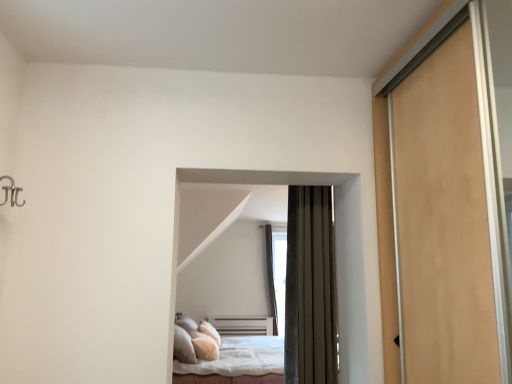
The image size is (512, 384). In order to click on transparent glass window at center in this screenshot , I will do `click(277, 275)`.

Describe the element at coordinates (225, 355) in the screenshot. The height and width of the screenshot is (384, 512). I see `white soft bed at center, positioned as the 1th bed in back-to-front order` at that location.

The height and width of the screenshot is (384, 512). Describe the element at coordinates (262, 177) in the screenshot. I see `dark brown fabric bed at center, which is the 2th bed from bottom to top` at that location.

This screenshot has height=384, width=512. I want to click on transparent glass window at center, so click(x=277, y=275).

Is transparent glass window at center facing towards dark brown fabric bed at center, which is the 2th bed from bottom to top?

No.

From a real-world perspective, between transparent glass window at center and dark brown fabric bed at center, the 1th bed viewed from the top, who is vertically lower?

transparent glass window at center.

Which object is further away from the camera taking this photo, transparent glass window at center or dark brown fabric bed at center, which ranks as the first bed in front-to-back order?

transparent glass window at center is behind.

Considering the sizes of objects transparent glass window at center and dark brown fabric bed at center, which ranks as the first bed in front-to-back order, in the image provided, who is wider, transparent glass window at center or dark brown fabric bed at center, which ranks as the first bed in front-to-back order,?

Wider between the two is transparent glass window at center.

Is dark brown fabric bed at center, which ranks as the 2th bed in back-to-front order, positioned far away from transparent glass window at center?

That's right, there is a large distance between dark brown fabric bed at center, which ranks as the 2th bed in back-to-front order, and transparent glass window at center.

Does point (169, 369) come in front of point (268, 268)?

Yes, it is.

Is dark brown fabric bed at center, which is the 2th bed from bottom to top, turned away from transparent glass window at center?

No, dark brown fabric bed at center, which is the 2th bed from bottom to top,'s orientation is not away from transparent glass window at center.

Is transparent glass window at center completely or partially inside dark brown fabric bed at center, which ranks as the 2th bed in back-to-front order?

That's incorrect, transparent glass window at center is not inside dark brown fabric bed at center, which ranks as the 2th bed in back-to-front order.

Is dark brown fabric bed at center, which ranks as the first bed in front-to-back order, not inside white soft bed at center, which appears as the second bed when viewed from the top?

Yes, dark brown fabric bed at center, which ranks as the first bed in front-to-back order, is outside of white soft bed at center, which appears as the second bed when viewed from the top.

Considering the positions of points (283, 173) and (211, 327), is point (283, 173) farther from camera compared to point (211, 327)?

No, it is not.

Who is smaller, dark brown fabric bed at center, which is the 2th bed from bottom to top, or white soft bed at center, positioned as the 1th bed in back-to-front order?

With smaller size is dark brown fabric bed at center, which is the 2th bed from bottom to top.

Is dark brown fabric bed at center, which ranks as the 2th bed in back-to-front order, to the left of white soft bed at center, positioned as the 1th bed in back-to-front order, from the viewer's perspective?

Incorrect, dark brown fabric bed at center, which ranks as the 2th bed in back-to-front order, is not on the left side of white soft bed at center, positioned as the 1th bed in back-to-front order.

Which object is more forward, white soft bed at center, positioned as the 1th bed in back-to-front order, or transparent glass window at center?

white soft bed at center, positioned as the 1th bed in back-to-front order.

From the image's perspective, which is below, white soft bed at center, marked as the first bed in a bottom-to-top arrangement, or transparent glass window at center?

white soft bed at center, marked as the first bed in a bottom-to-top arrangement, appears lower in the image.

Who is shorter, white soft bed at center, positioned as the 1th bed in back-to-front order, or transparent glass window at center?

With less height is white soft bed at center, positioned as the 1th bed in back-to-front order.

Between white soft bed at center, which appears as the second bed when viewed from the top, and dark brown fabric bed at center, which ranks as the first bed in front-to-back order, which one appears on the left side from the viewer's perspective?

white soft bed at center, which appears as the second bed when viewed from the top.

I want to click on bed to the left of dark brown fabric bed at center, which is the 2th bed from bottom to top, so click(225, 355).

Is point (240, 382) positioned behind point (188, 179)?

Yes, it is behind point (188, 179).

From a real-world perspective, is white soft bed at center, which appears as the second bed when viewed from the top, under dark brown fabric bed at center, the 1th bed viewed from the top?

Yes, from a real-world perspective, white soft bed at center, which appears as the second bed when viewed from the top, is beneath dark brown fabric bed at center, the 1th bed viewed from the top.

How distant is transparent glass window at center from white soft bed at center, positioned as the 1th bed in back-to-front order?

transparent glass window at center and white soft bed at center, positioned as the 1th bed in back-to-front order, are 1.01 meters apart from each other.

From a real-world perspective, is transparent glass window at center physically above white soft bed at center, positioned as the 1th bed in back-to-front order?

Yes, from a real-world perspective, transparent glass window at center is above white soft bed at center, positioned as the 1th bed in back-to-front order.

Is transparent glass window at center turned away from white soft bed at center, marked as the first bed in a bottom-to-top arrangement?

No, transparent glass window at center's orientation is not away from white soft bed at center, marked as the first bed in a bottom-to-top arrangement.

Is transparent glass window at center located outside white soft bed at center, marked as the first bed in a bottom-to-top arrangement?

Yes, transparent glass window at center is outside of white soft bed at center, marked as the first bed in a bottom-to-top arrangement.

The width and height of the screenshot is (512, 384). What are the coordinates of `window on the right of dark brown fabric bed at center, which ranks as the first bed in front-to-back order` in the screenshot? It's located at (277, 275).

Find the location of a particular element. window below the dark brown fabric bed at center, which ranks as the first bed in front-to-back order (from a real-world perspective) is located at coordinates (277, 275).

Considering their positions, is dark brown fabric bed at center, which is the 2th bed from bottom to top, positioned closer to transparent glass window at center than white soft bed at center, positioned as the 1th bed in back-to-front order?

Among the two, white soft bed at center, positioned as the 1th bed in back-to-front order, is located nearer to transparent glass window at center.

Estimate the real-world distances between objects in this image. Which object is closer to white soft bed at center, positioned as the 1th bed in back-to-front order, transparent glass window at center or dark brown fabric bed at center, which is the 2th bed from bottom to top?

Among the two, transparent glass window at center is located nearer to white soft bed at center, positioned as the 1th bed in back-to-front order.

Based on their spatial positions, is white soft bed at center, which is the second bed in front-to-back order, or dark brown fabric bed at center, which ranks as the first bed in front-to-back order, further from transparent glass window at center?

dark brown fabric bed at center, which ranks as the first bed in front-to-back order, lies further to transparent glass window at center than the other object.

Considering their positions, is white soft bed at center, which is the second bed in front-to-back order, positioned further to dark brown fabric bed at center, which is the 2th bed from bottom to top, than transparent glass window at center?

transparent glass window at center is positioned further to the anchor dark brown fabric bed at center, which is the 2th bed from bottom to top.

Considering their positions, is dark brown fabric bed at center, which is the 2th bed from bottom to top, positioned closer to white soft bed at center, which is the second bed in front-to-back order, than transparent glass window at center?

Among the two, transparent glass window at center is located nearer to white soft bed at center, which is the second bed in front-to-back order.

Looking at this image, which object lies further to the anchor point dark brown fabric bed at center, the 1th bed viewed from the top, transparent glass window at center or white soft bed at center, which is the second bed in front-to-back order?

transparent glass window at center.

At what (x,y) coordinates should I click in order to perform the action: click on bed between dark brown fabric bed at center, which is the 2th bed from bottom to top, and transparent glass window at center in the front-back direction. Please return your answer as a coordinate pair (x, y). The image size is (512, 384). Looking at the image, I should click on click(x=225, y=355).